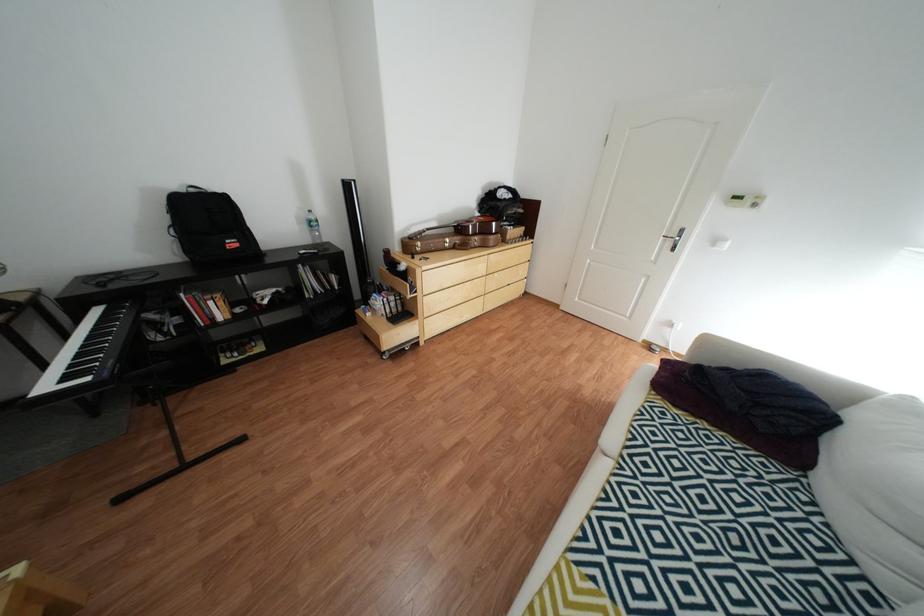
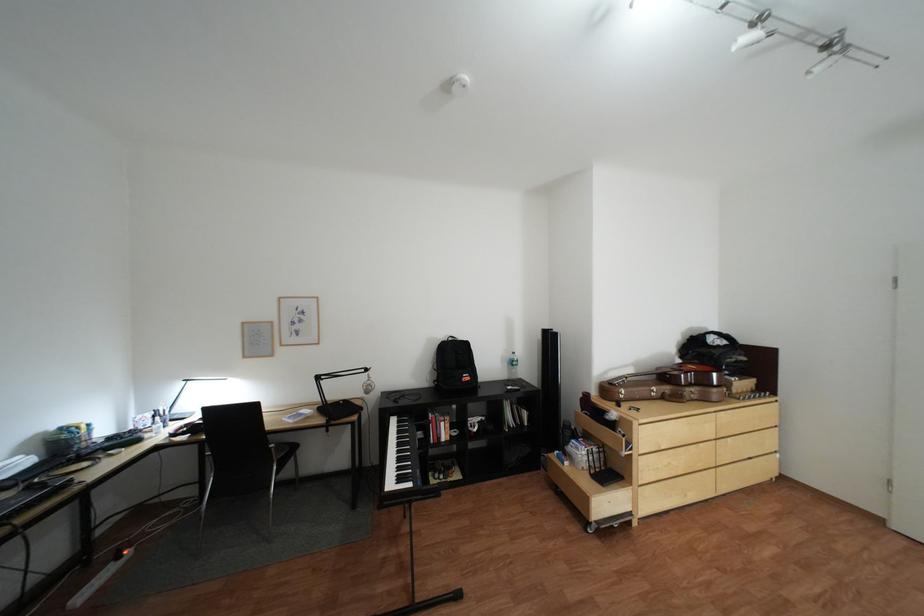
In the second image, find the point that corresponds to [208,191] in the first image.

(466, 339)